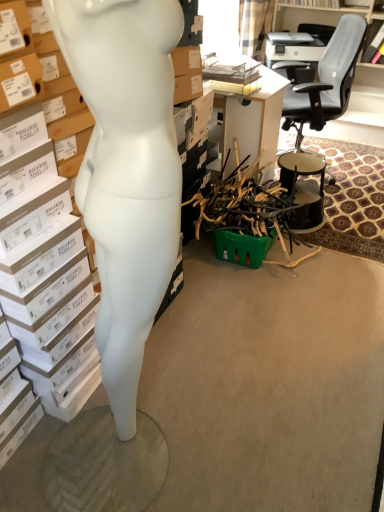
Question: Does white cardboard box at left turn towards white matte mannequin at left?

Choices:
 (A) no
 (B) yes

Answer: (B)

Question: Is white cardboard box at left located outside white matte mannequin at left?

Choices:
 (A) yes
 (B) no

Answer: (A)

Question: Is white cardboard box at left not near white matte mannequin at left?

Choices:
 (A) yes
 (B) no

Answer: (B)

Question: Is white matte mannequin at left at the back of white cardboard box at left?

Choices:
 (A) no
 (B) yes

Answer: (A)

Question: Does white cardboard box at left come in front of white matte mannequin at left?

Choices:
 (A) no
 (B) yes

Answer: (A)

Question: From the image's perspective, is white cardboard box at left on white matte mannequin at left?

Choices:
 (A) yes
 (B) no

Answer: (A)

Question: Is white matte mannequin at left positioned with its back to black leather office chair at upper right?

Choices:
 (A) yes
 (B) no

Answer: (B)

Question: Is white matte mannequin at left completely or partially outside of black leather office chair at upper right?

Choices:
 (A) yes
 (B) no

Answer: (A)

Question: From a real-world perspective, does white matte mannequin at left sit lower than black leather office chair at upper right?

Choices:
 (A) yes
 (B) no

Answer: (B)

Question: Is white matte mannequin at left next to black leather office chair at upper right?

Choices:
 (A) yes
 (B) no

Answer: (B)

Question: From the image's perspective, is white matte mannequin at left located beneath black leather office chair at upper right?

Choices:
 (A) yes
 (B) no

Answer: (A)

Question: Considering the relative positions of white matte mannequin at left and black leather office chair at upper right in the image provided, is white matte mannequin at left to the right of black leather office chair at upper right from the viewer's perspective?

Choices:
 (A) no
 (B) yes

Answer: (A)

Question: Does white cardboard box at left appear on the left side of black glossy drum at right?

Choices:
 (A) yes
 (B) no

Answer: (A)